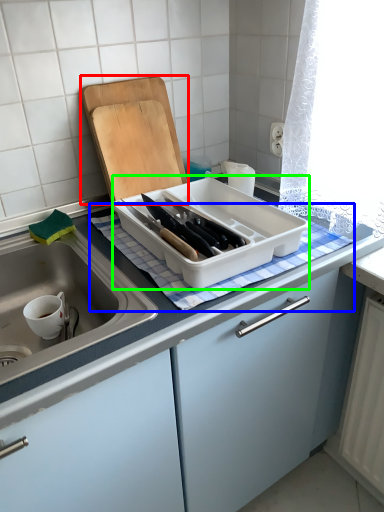
Question: Which is nearer to the cutting board (highlighted by a red box)? tablecloth (highlighted by a blue box) or kitchen appliance (highlighted by a green box).

Choices:
 (A) tablecloth
 (B) kitchen appliance

Answer: (B)